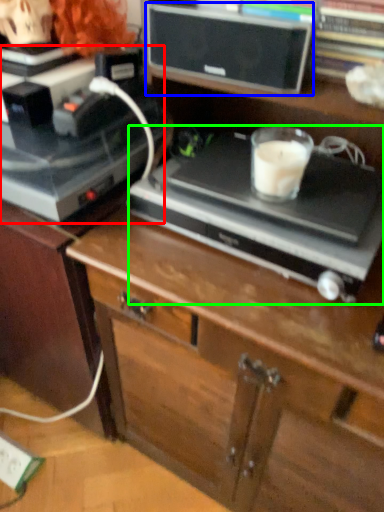
Question: Estimate the real-world distances between objects in this image. Which object is farther from appliance (highlighted by a red box), speaker (highlighted by a blue box) or appliance (highlighted by a green box)?

Choices:
 (A) speaker
 (B) appliance

Answer: (A)